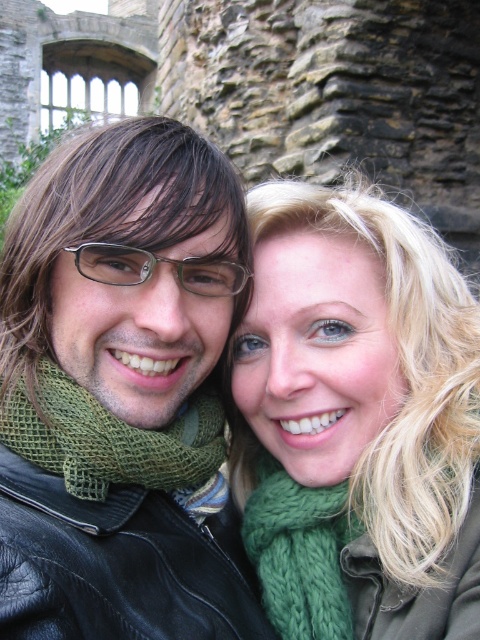
Can you confirm if green knitted scarf at center is taller than green knitted scarf at left?

Correct, green knitted scarf at center is much taller as green knitted scarf at left.

Is point (360, 378) farther from viewer compared to point (86, 420)?

Yes.

This screenshot has height=640, width=480. What are the coordinates of `green knitted scarf at center` in the screenshot? It's located at (357, 419).

Where is `green knitted scarf at center`? This screenshot has height=640, width=480. green knitted scarf at center is located at coordinates (357, 419).

This screenshot has height=640, width=480. Find the location of `green knitted scarf at left`. green knitted scarf at left is located at coordinates (108, 438).

Does point (153, 458) lie behind point (276, 488)?

No.

Find the location of a particular element. green knitted scarf at left is located at coordinates (108, 438).

In the scene shown: Is green knitted scarf at left thinner than clear plastic glasses at center?

No, green knitted scarf at left is not thinner than clear plastic glasses at center.

You are a GUI agent. You are given a task and a screenshot of the screen. Output one action in this format:
    pyautogui.click(x=<x>, y=<y>)
    Task: Click on the green knitted scarf at left
    
    Given the screenshot: What is the action you would take?
    pyautogui.click(x=108, y=438)

Which is behind, point (49, 449) or point (202, 269)?

Positioned behind is point (202, 269).

Locate an element on the screen. The image size is (480, 640). green knitted scarf at left is located at coordinates (108, 438).